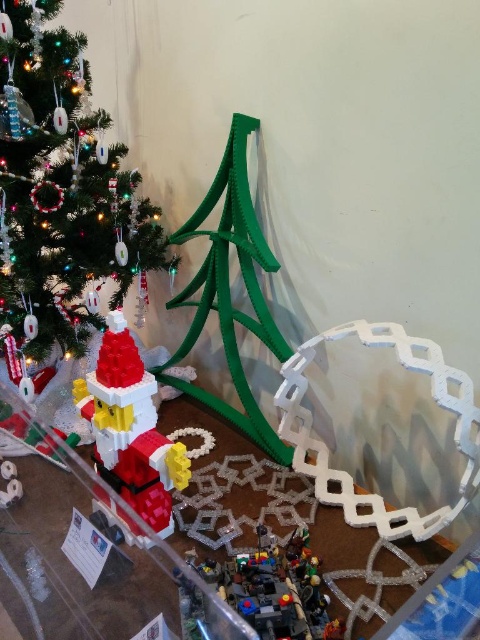
Please check the coordinates of the green matte christmas tree at left. Is it located at point (61,186)?

Yes, the green matte christmas tree at left is located at point (61,186).